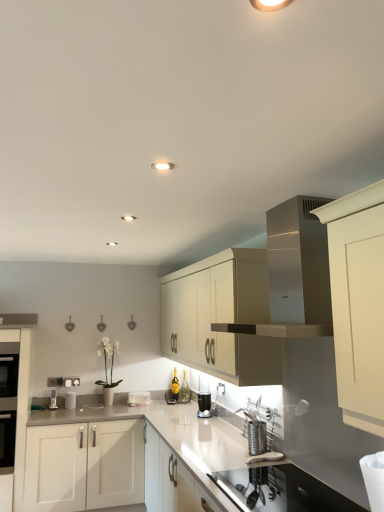
Question: Is the depth of white glossy toaster at center, marked as the 1th appliance in a back-to-front arrangement, less than that of black glass oven at left?

Choices:
 (A) no
 (B) yes

Answer: (A)

Question: Considering the relative positions of white glossy toaster at center, the 3th appliance viewed from the front, and black glass oven at left in the image provided, is white glossy toaster at center, the 3th appliance viewed from the front, to the left of black glass oven at left from the viewer's perspective?

Choices:
 (A) yes
 (B) no

Answer: (B)

Question: From the image's perspective, is white glossy toaster at center, which is the 2th appliance in left-to-right order, on black glass oven at left?

Choices:
 (A) no
 (B) yes

Answer: (B)

Question: Is white glossy toaster at center, the second appliance in the right-to-left sequence, not within black glass oven at left?

Choices:
 (A) yes
 (B) no

Answer: (A)

Question: Is white glossy toaster at center, which is the 2th appliance in left-to-right order, oriented towards black glass oven at left?

Choices:
 (A) no
 (B) yes

Answer: (A)

Question: Can you confirm if white glossy toaster at center, which is the 2th appliance in left-to-right order, is shorter than black glass oven at left?

Choices:
 (A) yes
 (B) no

Answer: (A)

Question: Is satin silver vent at upper center a part of clear glass cup at center, which is the 1th appliance in right-to-left order?

Choices:
 (A) no
 (B) yes

Answer: (A)

Question: Is clear glass cup at center, the 3th appliance in the back-to-front sequence, positioned before satin silver vent at upper center?

Choices:
 (A) yes
 (B) no

Answer: (B)

Question: Is clear glass cup at center, which is the 1th appliance in right-to-left order, facing away from satin silver vent at upper center?

Choices:
 (A) yes
 (B) no

Answer: (B)

Question: From a real-world perspective, is clear glass cup at center, acting as the 3th appliance starting from the left, located higher than satin silver vent at upper center?

Choices:
 (A) yes
 (B) no

Answer: (B)

Question: From the image's perspective, is clear glass cup at center, which is the first appliance in front-to-back order, on top of satin silver vent at upper center?

Choices:
 (A) yes
 (B) no

Answer: (B)

Question: From the image's perspective, is clear glass cup at center, acting as the 3th appliance starting from the left, below satin silver vent at upper center?

Choices:
 (A) yes
 (B) no

Answer: (A)

Question: Is matte cream cabinet at center, the second cabinetry from the left, next to white glossy countertop at center and touching it?

Choices:
 (A) yes
 (B) no

Answer: (B)